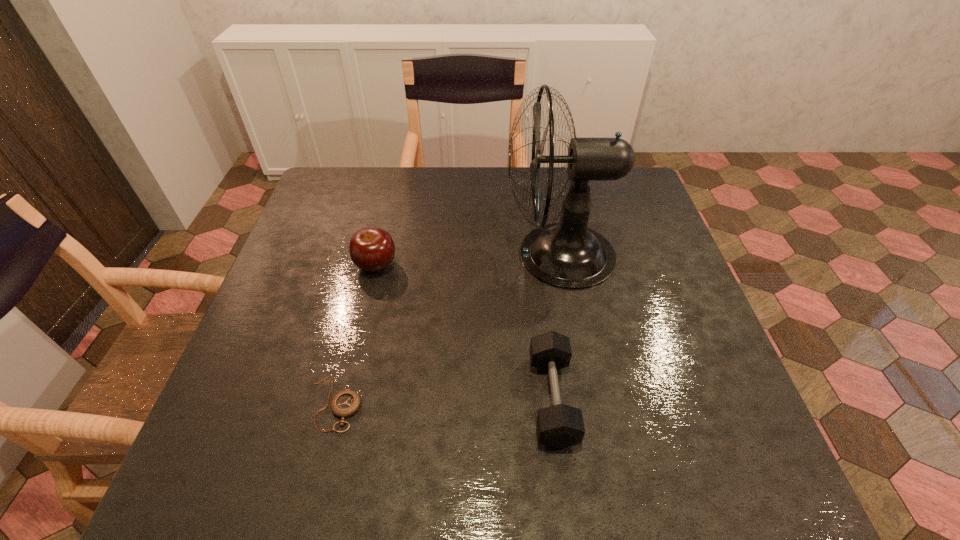
Identify the location of the tallest object. The image size is (960, 540). (569, 255).

Find the location of a particular element. apple is located at coordinates (371, 249).

Identify the location of the second shortest object. This screenshot has height=540, width=960. (559, 426).

Where is `the shortest object`? the shortest object is located at coordinates (346, 403).

Locate an element on the screen. This screenshot has width=960, height=540. vacant area situated on the front-facing side of the fan is located at coordinates (409, 255).

At what (x,y) coordinates should I click in order to perform the action: click on vacant area located 0.100m on the front-facing side of the fan. Please return your answer as a coordinate pair (x, y). The width and height of the screenshot is (960, 540). Looking at the image, I should click on (466, 255).

Image resolution: width=960 pixels, height=540 pixels. I want to click on free space located on the front-facing side of the fan, so click(447, 255).

You are a GUI agent. You are given a task and a screenshot of the screen. Output one action in this format:
    pyautogui.click(x=<x>, y=<y>)
    Task: Click on the vacant area situated on the front of the apple
    This screenshot has height=540, width=960.
    Given the screenshot: What is the action you would take?
    pyautogui.click(x=368, y=302)

Find the location of a particular element. free space located on the left of the dumbbell is located at coordinates (488, 399).

This screenshot has height=540, width=960. What are the coordinates of `vacant space located on the back of the pocket watch` in the screenshot? It's located at (366, 279).